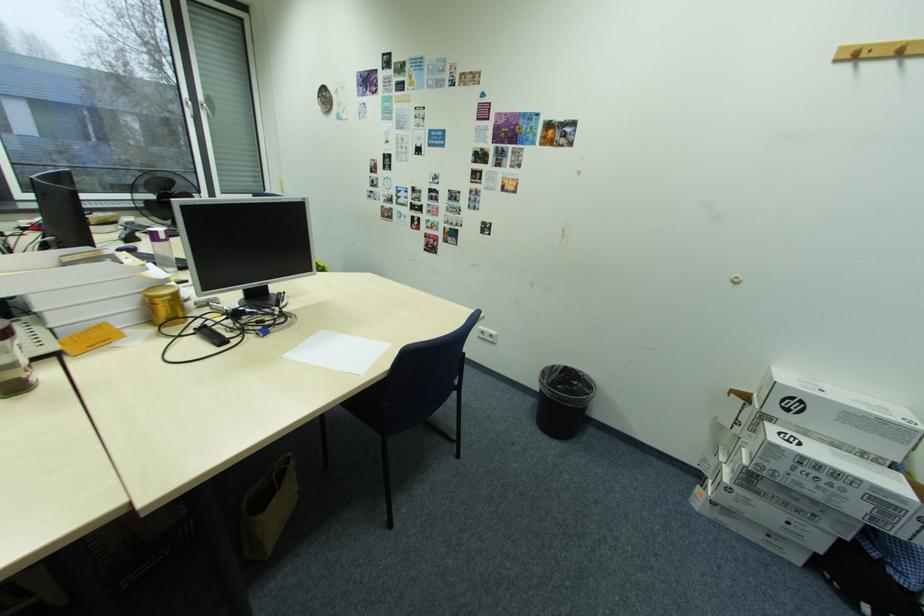
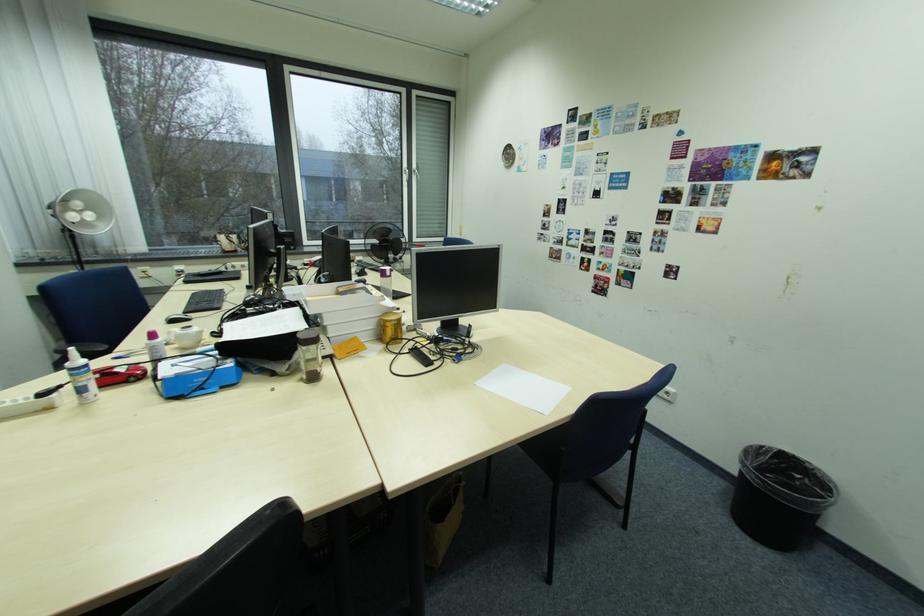
Question: Based on the continuous images, in which direction is the camera rotating? Reply with the corresponding letter.

Choices:
 (A) Left
 (B) Right
 (C) Up
 (D) Down

Answer: (A)